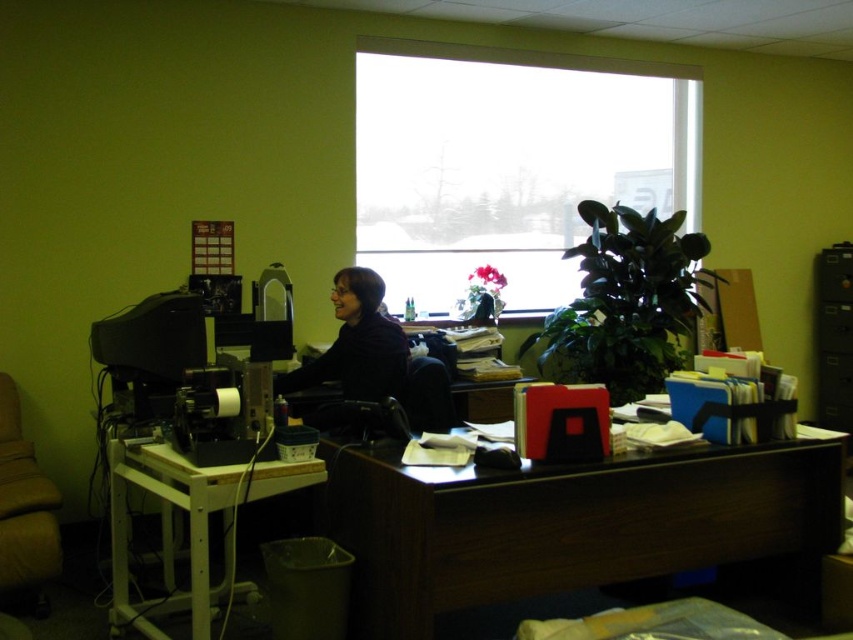
Based on the photo, you are an office worker who needs to hang a decorative banner that is wider than the matte black shirt at center. Can you hang it on the transparent glass window at upper center?

The transparent glass window at upper center is wider than the matte black shirt at center, so yes, the banner can be hung there as it has sufficient width.

What object is located at the coordinates point [567,524]?

The dark wood desk at center is located at point [567,524].